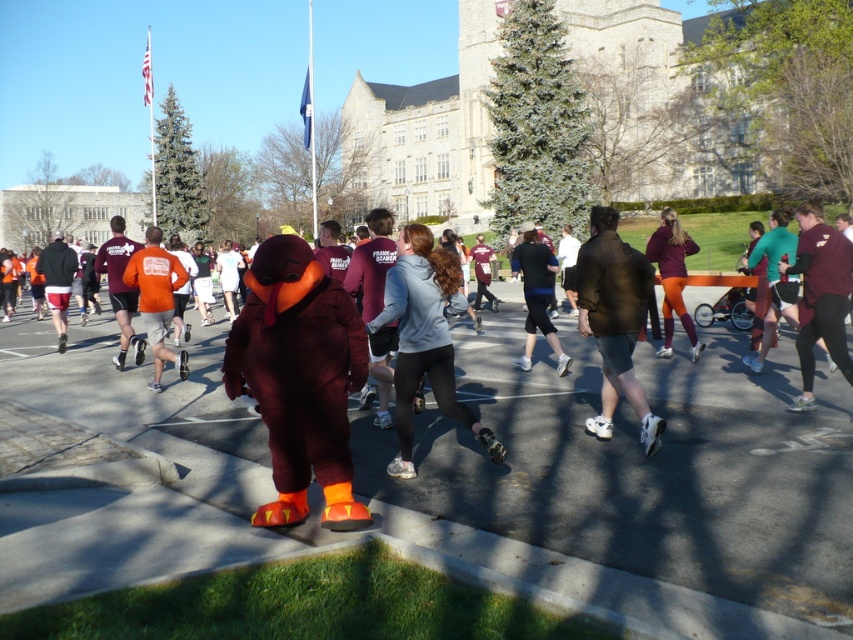
Who is shorter, gray matte hoodie at center or maroon jersey at right?

gray matte hoodie at center

Is point (439, 342) positioned after point (816, 337)?

No, (439, 342) is closer to viewer.

Where is `gray matte hoodie at center`? gray matte hoodie at center is located at coordinates (424, 339).

Can you confirm if smooth asphalt road at center is positioned to the left of maroon fabric turkey at center?

Correct, you'll find smooth asphalt road at center to the left of maroon fabric turkey at center.

Can you confirm if smooth asphalt road at center is positioned above maroon fabric turkey at center?

No.

Identify the location of smooth asphalt road at center. This screenshot has width=853, height=640. (634, 488).

Between dark gray leggings at center and maroon fabric pants at center, which one appears on the left side from the viewer's perspective?

Answer: dark gray leggings at center

The height and width of the screenshot is (640, 853). I want to click on dark gray leggings at center, so click(x=537, y=296).